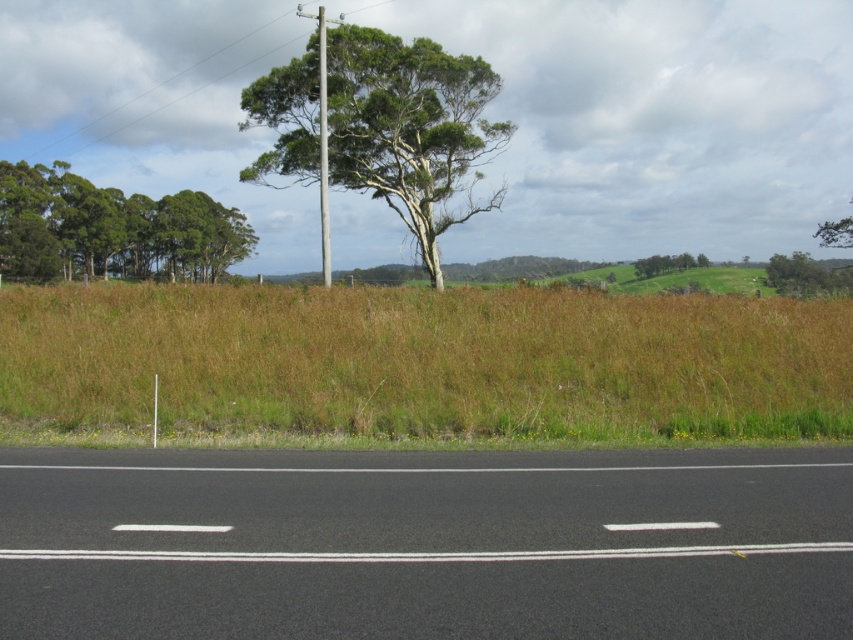
Between green leafy tree at upper right and smooth gray pole at center, which one is positioned higher?

Positioned higher is smooth gray pole at center.

Can you confirm if green leafy tree at upper right is wider than smooth gray pole at center?

Yes, green leafy tree at upper right is wider than smooth gray pole at center.

Describe the element at coordinates (805, 276) in the screenshot. I see `green leafy tree at upper right` at that location.

Where is `green leafy tree at upper right`? green leafy tree at upper right is located at coordinates (805, 276).

Is green leafy trees at left thinner than green leafy tree at upper right?

Yes, green leafy trees at left is thinner than green leafy tree at upper right.

Is green leafy trees at left to the right of green leafy tree at upper right from the viewer's perspective?

Incorrect, green leafy trees at left is not on the right side of green leafy tree at upper right.

Is point (94, 237) positioned in front of point (775, 288)?

Yes, it is in front of point (775, 288).

Locate an element on the screen. This screenshot has height=640, width=853. green leafy trees at left is located at coordinates [x=109, y=228].

Can you confirm if brown dry grass at center is positioned to the right of green leafy tree at upper center?

Incorrect, brown dry grass at center is not on the right side of green leafy tree at upper center.

I want to click on brown dry grass at center, so click(x=425, y=362).

Measure the distance between brown dry grass at center and camera.

A distance of 14.46 meters exists between brown dry grass at center and camera.

Identify the location of brown dry grass at center. (425, 362).